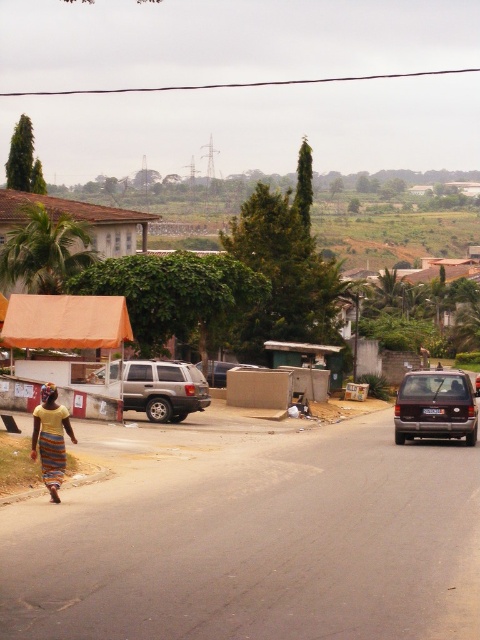
Question: Which object is farther from the camera taking this photo?

Choices:
 (A) striped cotton dress at lower left
 (B) satin brown van at right

Answer: (B)

Question: Which point is closer to the camera taking this photo?

Choices:
 (A) (175, 372)
 (B) (34, 442)

Answer: (B)

Question: Is the position of silver metallic suv at center less distant than that of striped fabric dress at lower left?

Choices:
 (A) yes
 (B) no

Answer: (B)

Question: From the image, what is the correct spatial relationship of striped fabric dress at lower left in relation to striped cotton dress at lower left?

Choices:
 (A) above
 (B) below

Answer: (A)

Question: Can you confirm if silver metallic suv at center is positioned to the left of striped cotton dress at lower left?

Choices:
 (A) no
 (B) yes

Answer: (B)

Question: Among these points, which one is farthest from the camera?

Choices:
 (A) (57, 474)
 (B) (58, 410)
 (C) (406, 419)
 (D) (177, 381)

Answer: (D)